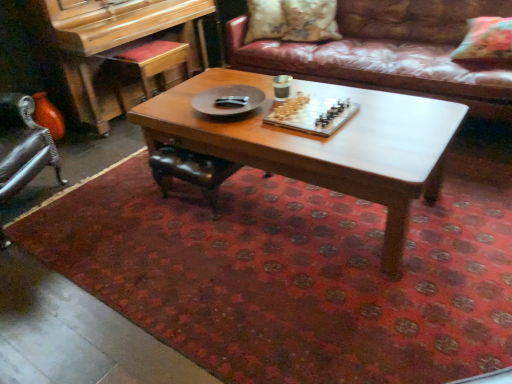
Question: Does floral fabric pillow at upper right, arranged as the third pillow when viewed from the left, have a lesser height compared to fluffy beige pillow at upper center, arranged as the second pillow when viewed from the back?

Choices:
 (A) yes
 (B) no

Answer: (A)

Question: Is floral fabric pillow at upper right, which is the third pillow in back-to-front order, outside of fluffy beige pillow at upper center, which appears as the second pillow when viewed from the left?

Choices:
 (A) no
 (B) yes

Answer: (B)

Question: From the image's perspective, is floral fabric pillow at upper right, arranged as the third pillow when viewed from the left, located above fluffy beige pillow at upper center, arranged as the second pillow when viewed from the back?

Choices:
 (A) no
 (B) yes

Answer: (A)

Question: From a real-world perspective, is floral fabric pillow at upper right, arranged as the third pillow when viewed from the left, physically below fluffy beige pillow at upper center, which appears as the second pillow when viewed from the left?

Choices:
 (A) no
 (B) yes

Answer: (B)

Question: Does floral fabric pillow at upper right, which ranks as the first pillow in front-to-back order, have a greater height compared to fluffy beige pillow at upper center, which appears as the second pillow when viewed from the right?

Choices:
 (A) yes
 (B) no

Answer: (B)

Question: In terms of width, does wooden chessboard at center look wider or thinner when compared to floral fabric pillow at upper right, which is the third pillow in back-to-front order?

Choices:
 (A) wide
 (B) thin

Answer: (A)

Question: Relative to floral fabric pillow at upper right, acting as the 1th pillow starting from the right, is wooden chessboard at center in front or behind?

Choices:
 (A) behind
 (B) front

Answer: (B)

Question: From the image's perspective, relative to floral fabric pillow at upper right, which is the third pillow in back-to-front order, is wooden chessboard at center above or below?

Choices:
 (A) below
 (B) above

Answer: (A)

Question: Is point (253, 155) positioned closer to the camera than point (503, 34)?

Choices:
 (A) closer
 (B) farther

Answer: (A)

Question: Considering the positions of floral fabric pillow at upper center, arranged as the third pillow when viewed from the right, and floral fabric pillow at upper right, which ranks as the first pillow in front-to-back order, in the image, is floral fabric pillow at upper center, arranged as the third pillow when viewed from the right, wider or thinner than floral fabric pillow at upper right, which ranks as the first pillow in front-to-back order,?

Choices:
 (A) thin
 (B) wide

Answer: (A)

Question: Considering their positions, is floral fabric pillow at upper center, which is counted as the first pillow, starting from the left, located in front of or behind floral fabric pillow at upper right, acting as the 1th pillow starting from the right?

Choices:
 (A) behind
 (B) front

Answer: (A)

Question: From a real-world perspective, is floral fabric pillow at upper center, the third pillow when ordered from front to back, physically located above or below floral fabric pillow at upper right, arranged as the third pillow when viewed from the left?

Choices:
 (A) above
 (B) below

Answer: (A)

Question: Would you say floral fabric pillow at upper center, the third pillow when ordered from front to back, is inside or outside floral fabric pillow at upper right, acting as the 1th pillow starting from the right?

Choices:
 (A) outside
 (B) inside

Answer: (A)

Question: In terms of width, does wooden piano at left look wider or thinner when compared to floral fabric pillow at upper right, acting as the 1th pillow starting from the right?

Choices:
 (A) wide
 (B) thin

Answer: (A)

Question: From the image's perspective, is wooden piano at left located above or below floral fabric pillow at upper right, which is the third pillow in back-to-front order?

Choices:
 (A) above
 (B) below

Answer: (A)